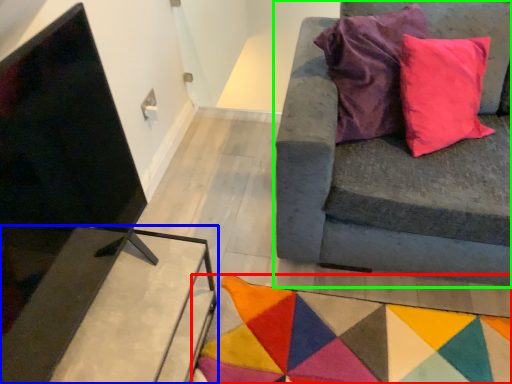
Question: Estimate the real-world distances between objects in this image. Which object is farther from mat (highlighted by a red box), table (highlighted by a blue box) or studio couch (highlighted by a green box)?

Choices:
 (A) table
 (B) studio couch

Answer: (A)